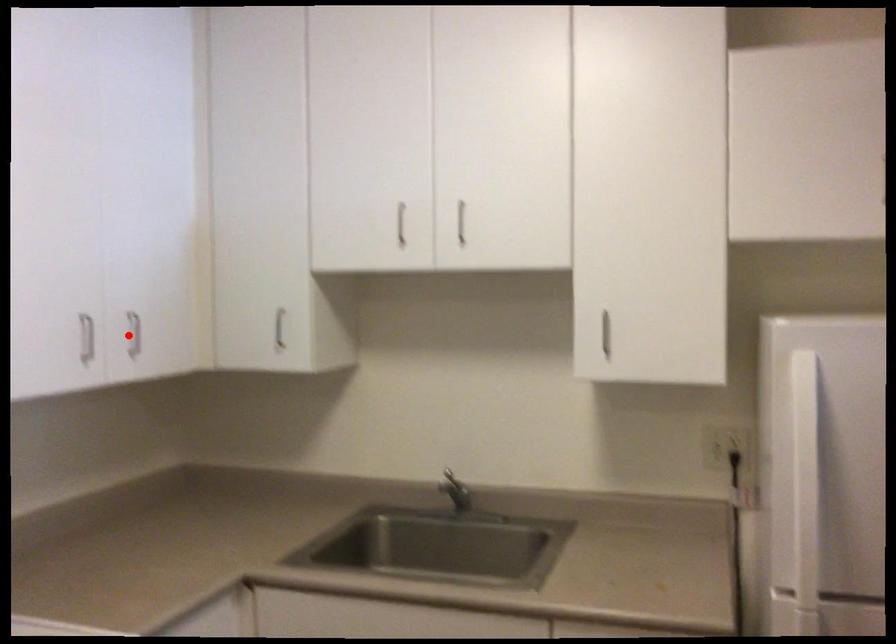
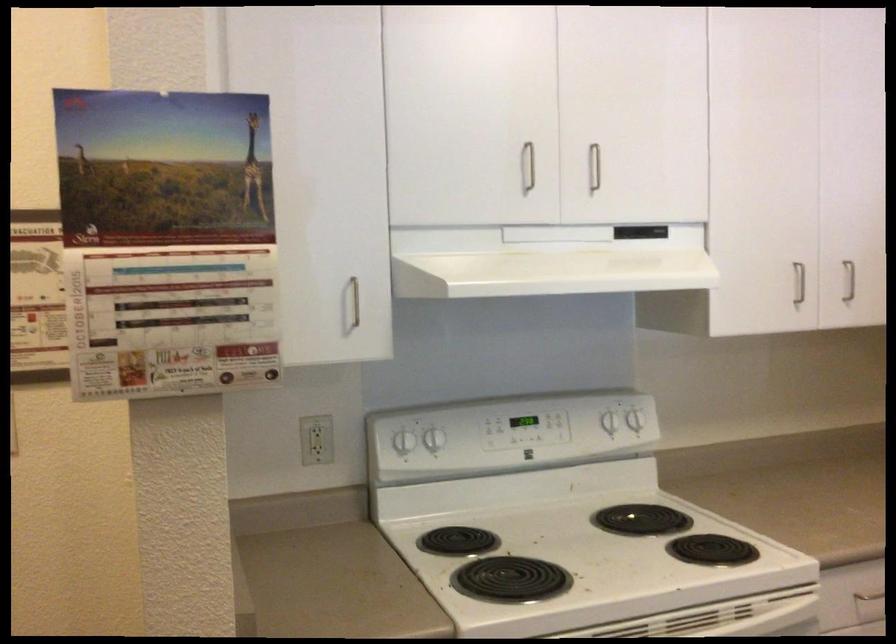
The point at the highlighted location is marked in the first image. Where is the corresponding point in the second image?

(849, 281)